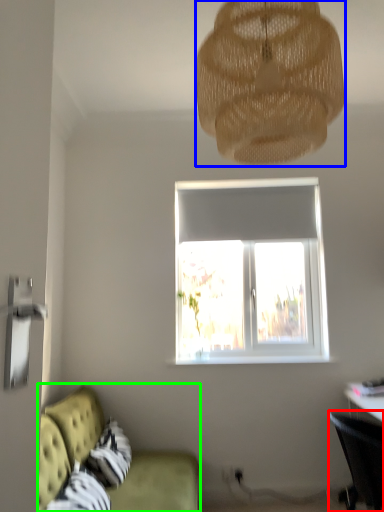
Question: Which object is the closest to the chair (highlighted by a red box)? Choose among these: lamp (highlighted by a blue box) or studio couch (highlighted by a green box).

Choices:
 (A) lamp
 (B) studio couch

Answer: (B)